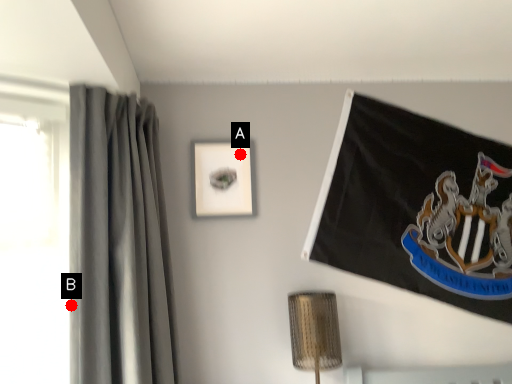
Question: Two points are circled on the image, labeled by A and B beside each circle. Which point is closer to the camera taking this photo?

Choices:
 (A) A is closer
 (B) B is closer

Answer: (B)